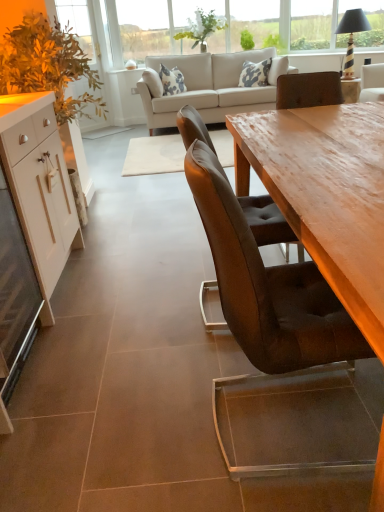
Where is `white glossy cabinet at left`? Image resolution: width=384 pixels, height=512 pixels. white glossy cabinet at left is located at coordinates (40, 181).

What do you see at coordinates (12, 173) in the screenshot? I see `white glossy cabinet at left` at bounding box center [12, 173].

The image size is (384, 512). Identify the location of clear glass window at upper center. (155, 25).

What are the coordinates of `beige fabric couch at upper center` in the screenshot? It's located at (211, 86).

Is beige fabric couch at upper center aimed at green leafy plant at upper center, which is the 2th plant from left to right?

No, beige fabric couch at upper center is not turned towards green leafy plant at upper center, which is the 2th plant from left to right.

Is beige fabric couch at upper center with green leafy plant at upper center, which is the 2th plant from left to right?

No, beige fabric couch at upper center is not touching green leafy plant at upper center, which is the 2th plant from left to right.

Is beige fabric couch at upper center to the right of green leafy plant at upper center, which ranks as the 1th plant in right-to-left order, from the viewer's perspective?

No, beige fabric couch at upper center is not to the right of green leafy plant at upper center, which ranks as the 1th plant in right-to-left order.

In the image, is beige fabric couch at upper center positioned in front of or behind green leafy plant at upper center, which is the 2th plant from left to right?

beige fabric couch at upper center is positioned closer to the viewer than green leafy plant at upper center, which is the 2th plant from left to right.

Considering the relative positions of wooden striped base at upper right and beige fabric couch at upper center in the image provided, is wooden striped base at upper right to the right of beige fabric couch at upper center from the viewer's perspective?

Correct, you'll find wooden striped base at upper right to the right of beige fabric couch at upper center.

Between wooden striped base at upper right and beige fabric couch at upper center, which one has larger width?

With larger width is beige fabric couch at upper center.

Between wooden striped base at upper right and beige fabric couch at upper center, which one has more height?

beige fabric couch at upper center is taller.

The height and width of the screenshot is (512, 384). I want to click on studio couch below the wooden striped base at upper right (from the image's perspective), so click(211, 86).

From a real-world perspective, is wooden striped base at upper right located higher than leather chair at center?

Yes, from a real-world perspective, wooden striped base at upper right is on top of leather chair at center.

From the image's perspective, between wooden striped base at upper right and leather chair at center, who is located below?

leather chair at center, from the image's perspective.

In the image, is wooden striped base at upper right positioned in front of or behind leather chair at center?

In the image, wooden striped base at upper right appears behind leather chair at center.

Considering the relative sizes of wooden striped base at upper right and leather chair at center in the image provided, is wooden striped base at upper right bigger than leather chair at center?

Incorrect, wooden striped base at upper right is not larger than leather chair at center.

Identify the location of desk that appears on the left of green leafy plant at upper center, which appears as the 1th plant when viewed from the left. (12, 173).

Is point (192, 44) in front of point (0, 108)?

No, it is behind (0, 108).

Between green leafy plant at upper center, which appears as the 1th plant when viewed from the left, and white glossy cabinet at left, which one has less height?

With less height is green leafy plant at upper center, which appears as the 1th plant when viewed from the left.

From a real-world perspective, which object rests below the other?

white glossy cabinet at left, from a real-world perspective.

Which is more to the left, green leafy plant at upper center, which is counted as the 2th plant, starting from the right, or beige fabric couch at upper center?

Positioned to the left is green leafy plant at upper center, which is counted as the 2th plant, starting from the right.

In the scene shown: Looking at the image, does green leafy plant at upper center, which is counted as the 2th plant, starting from the right, seem bigger or smaller compared to beige fabric couch at upper center?

Clearly, green leafy plant at upper center, which is counted as the 2th plant, starting from the right, is smaller in size than beige fabric couch at upper center.

Which object is further away from the camera, green leafy plant at upper center, which appears as the 1th plant when viewed from the left, or beige fabric couch at upper center?

green leafy plant at upper center, which appears as the 1th plant when viewed from the left, is further from the camera.

Measure the distance between green leafy plant at upper center, which appears as the 1th plant when viewed from the left, and beige fabric couch at upper center.

A distance of 23.36 inches exists between green leafy plant at upper center, which appears as the 1th plant when viewed from the left, and beige fabric couch at upper center.

In the scene shown: Is the surface of white glossy cabinet at left in direct contact with wooden table at right?

No.

Between white glossy cabinet at left and wooden table at right, which one has more height?

Standing taller between the two is white glossy cabinet at left.

Is white glossy cabinet at left facing towards wooden table at right?

Yes.

From a real-world perspective, is white glossy cabinet at left physically below wooden table at right?

Incorrect, from a real-world perspective, white glossy cabinet at left is higher than wooden table at right.

From a real-world perspective, is white glossy cabinet at left under clear glass window at upper center?

Indeed, from a real-world perspective, white glossy cabinet at left is positioned beneath clear glass window at upper center.

From the image's perspective, which one is positioned lower, white glossy cabinet at left or clear glass window at upper center?

From the image's view, white glossy cabinet at left is below.

What's the angular difference between white glossy cabinet at left and clear glass window at upper center's facing directions?

The angle between the facing direction of white glossy cabinet at left and the facing direction of clear glass window at upper center is 89.4 degrees.

Is clear glass window at upper center inside white glossy cabinet at left?

No, clear glass window at upper center is not a part of white glossy cabinet at left.

The image size is (384, 512). I want to click on studio couch lying in front of the green leafy plant at upper center, which ranks as the 1th plant in right-to-left order, so click(211, 86).

I want to click on studio couch that appears on the left of wooden striped base at upper right, so coord(211,86).

Estimate the real-world distances between objects in this image. Which object is closer to white glossy cabinet at left, beige fabric couch at upper center or green leafy plant at upper center, which ranks as the 1th plant in right-to-left order?

The object closer to white glossy cabinet at left is beige fabric couch at upper center.

Considering their positions, is beige fabric couch at upper center positioned further to wooden table at right than green leafy plant at upper center, which is counted as the 2th plant, starting from the right?

Based on the image, green leafy plant at upper center, which is counted as the 2th plant, starting from the right, appears to be further to wooden table at right.

Considering their positions, is wooden striped base at upper right positioned further to white glossy cabinet at left than leather chair at center?

wooden striped base at upper right is positioned further to the anchor white glossy cabinet at left.

Estimate the real-world distances between objects in this image. Which object is closer to clear glass window at upper center, green leafy plant at upper center, which is the 2th plant from left to right, or white glossy cabinet at left?

green leafy plant at upper center, which is the 2th plant from left to right.

Considering their positions, is white glossy cabinet at left positioned further to leather chair at center than beige fabric couch at upper center?

The object further to leather chair at center is beige fabric couch at upper center.

Estimate the real-world distances between objects in this image. Which object is further from white glossy cabinet at left, leather chair at center or wooden table at right?

wooden table at right lies further to white glossy cabinet at left than the other object.

When comparing their distances from clear glass window at upper center, does wooden striped base at upper right or white glossy cabinet at left seem closer?

wooden striped base at upper right is positioned closer to the anchor clear glass window at upper center.

Looking at the image, which one is located closer to green leafy plant at upper center, which appears as the 1th plant when viewed from the left, beige fabric couch at upper center or green leafy plant at upper center, which is the 2th plant from left to right?

beige fabric couch at upper center is closer to green leafy plant at upper center, which appears as the 1th plant when viewed from the left.

Where is `window located between leather chair at center and green leafy plant at upper center, which is the 2th plant from left to right, in the depth direction`? This screenshot has height=512, width=384. window located between leather chair at center and green leafy plant at upper center, which is the 2th plant from left to right, in the depth direction is located at coordinates (155, 25).

This screenshot has width=384, height=512. What are the coordinates of `cabinetry positioned between white glossy cabinet at left and wooden striped base at upper right from near to far` in the screenshot? It's located at (40, 181).

Image resolution: width=384 pixels, height=512 pixels. I want to click on window positioned between white glossy cabinet at left and green leafy plant at upper center, which ranks as the 1th plant in right-to-left order, from near to far, so click(155, 25).

Locate an element on the screen. This screenshot has height=512, width=384. desk between white glossy cabinet at left and wooden table at right from left to right is located at coordinates (12, 173).